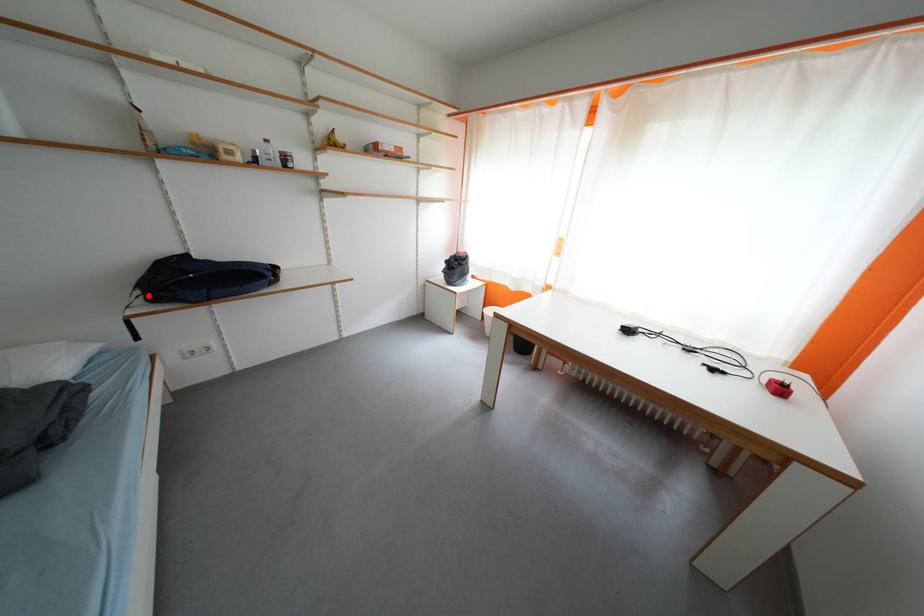
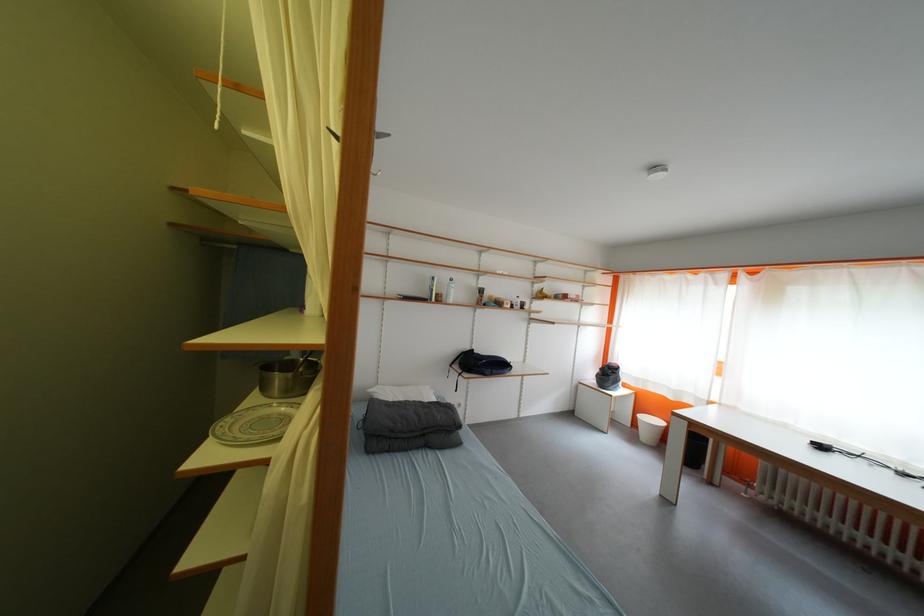
The point at the highlighted location is marked in the first image. Where is the corresponding point in the second image?

(466, 370)